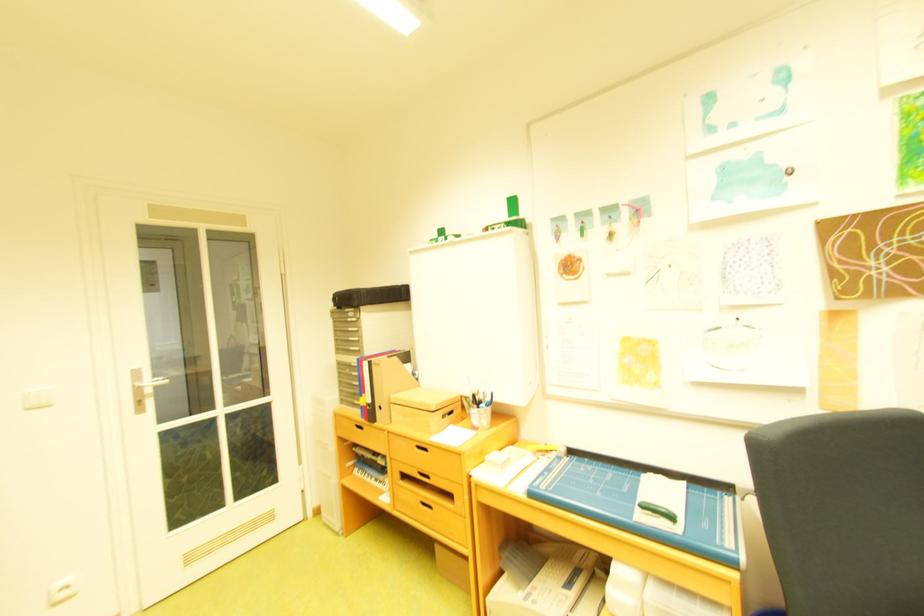
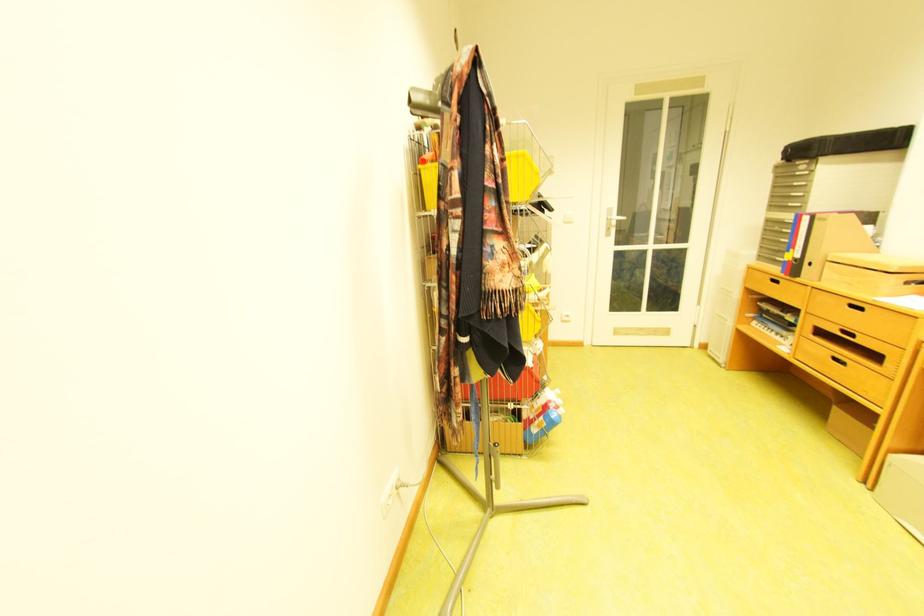
Find the pixel in the second image that matches (x=431, y=448) in the first image.

(862, 307)